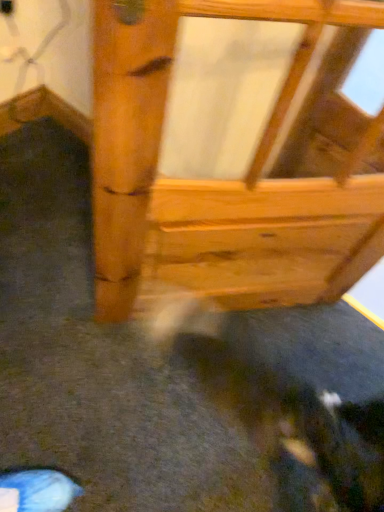
Describe the element at coordinates (218, 180) in the screenshot. I see `natural wood drawer at center` at that location.

Find the location of a particular element. Image resolution: width=384 pixels, height=512 pixels. natural wood drawer at center is located at coordinates (218, 180).

The image size is (384, 512). Identify the location of natural wood drawer at center. (218, 180).